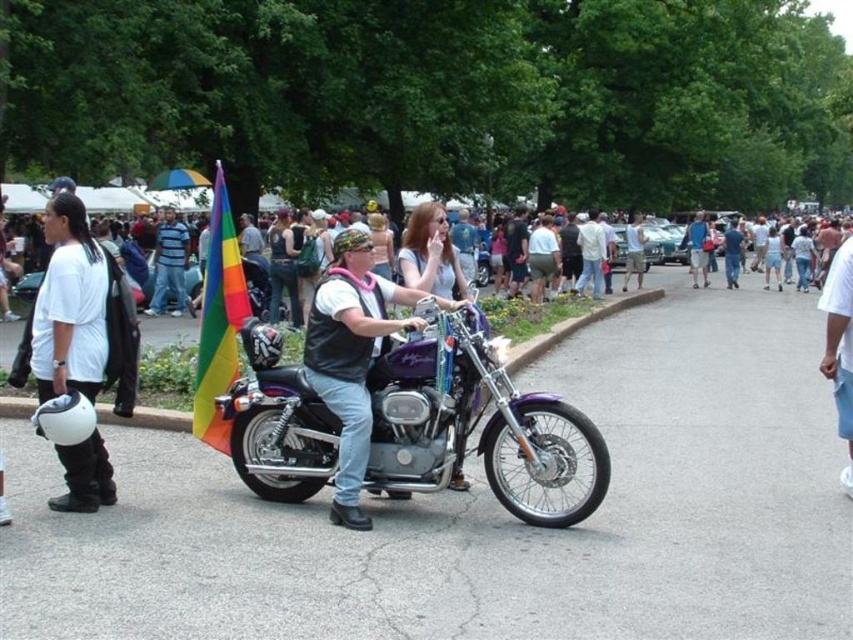
Is matte black motorcycle at center smaller than rainbow fabric flag at left?

Incorrect, matte black motorcycle at center is not smaller in size than rainbow fabric flag at left.

Does matte black motorcycle at center appear over rainbow fabric flag at left?

Indeed, matte black motorcycle at center is positioned over rainbow fabric flag at left.

The image size is (853, 640). What are the coordinates of `matte black motorcycle at center` in the screenshot? It's located at (351, 356).

Who is positioned more to the right, matte black motorcycle at center or striped cotton shirt at center?

Positioned to the right is matte black motorcycle at center.

Can you confirm if matte black motorcycle at center is positioned below striped cotton shirt at center?

Indeed, matte black motorcycle at center is positioned under striped cotton shirt at center.

Find the location of a particular element. The height and width of the screenshot is (640, 853). matte black motorcycle at center is located at coordinates (351, 356).

The height and width of the screenshot is (640, 853). Identify the location of matte black motorcycle at center. (351, 356).

Is point (442, 445) less distant than point (158, 291)?

That is True.

Where is `purple metallic motorcycle at center`? purple metallic motorcycle at center is located at coordinates (471, 419).

This screenshot has height=640, width=853. What do you see at coordinates (471, 419) in the screenshot?
I see `purple metallic motorcycle at center` at bounding box center [471, 419].

Locate an element on the screen. Image resolution: width=853 pixels, height=640 pixels. purple metallic motorcycle at center is located at coordinates (471, 419).